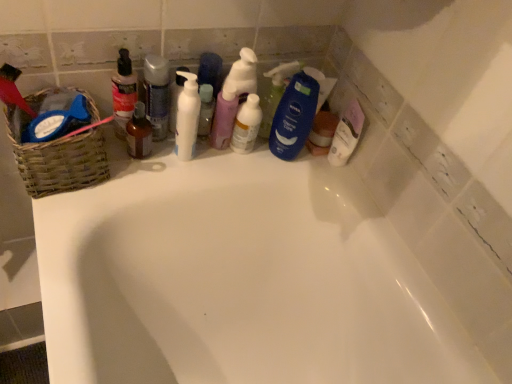
This screenshot has width=512, height=384. I want to click on translucent plastic spray bottle at center, the second cleaning product viewed from the right, so coord(246,125).

Measure the distance between point (300,141) and camera.

The distance of point (300,141) from camera is 37.95 inches.

What is the approximate width of woven brown basket at left?

The width of woven brown basket at left is 6.90 inches.

You are a GUI agent. You are given a task and a screenshot of the screen. Output one action in this format:
    pyautogui.click(x=<x>, y=<y>)
    Task: Click on the woven brown basket at left
    The image size is (512, 384).
    Given the screenshot: What is the action you would take?
    pyautogui.click(x=57, y=159)

The image size is (512, 384). I want to click on translucent plastic spray bottle at center, which appears as the 4th cleaning product when viewed from the right, so click(x=157, y=94).

Find the location of a particular element. The height and width of the screenshot is (384, 512). translucent plastic spray bottle at center, the second cleaning product viewed from the right is located at coordinates (246, 125).

Does woven brown basket at left have a greater width compared to translucent plastic spray bottle at center, which appears as the 4th cleaning product when viewed from the right?

Correct, the width of woven brown basket at left exceeds that of translucent plastic spray bottle at center, which appears as the 4th cleaning product when viewed from the right.

Which object is closer to the camera, woven brown basket at left or translucent plastic spray bottle at center, which appears as the 4th cleaning product when viewed from the right?

woven brown basket at left is more forward.

From the image's perspective, who appears lower, woven brown basket at left or translucent plastic spray bottle at center, the first cleaning product in the left-to-right sequence?

woven brown basket at left is shown below in the image.

How far apart are woven brown basket at left and translucent plastic spray bottle at center, which appears as the 4th cleaning product when viewed from the right?

7.02 inches.

Would you say translucent plastic bottle at upper left is to the left or to the right of brown glass bottle at center in the picture?

translucent plastic bottle at upper left is positioned on brown glass bottle at center's left side.

Considering the positions of points (126, 101) and (142, 132), is point (126, 101) closer to camera compared to point (142, 132)?

That is True.

Which of these two, translucent plastic bottle at upper left or brown glass bottle at center, stands taller?

With more height is translucent plastic bottle at upper left.

Find the location of a particular element. This screenshot has height=384, width=512. toiletry above the brown glass bottle at center (from the image's perspective) is located at coordinates click(123, 93).

From the image's perspective, is blue matte bottle at center, which is the first cleaning product from right to left, under white glossy bathtub at upper center?

Actually, blue matte bottle at center, which is the first cleaning product from right to left, appears above white glossy bathtub at upper center in the image.

Does point (294, 123) come in front of point (150, 255)?

No.

Between blue matte bottle at center, the 4th cleaning product when ordered from left to right, and white glossy bathtub at upper center, which one has more height?

white glossy bathtub at upper center.

How distant is blue matte bottle at center, which is the first cleaning product from right to left, from white glossy bathtub at upper center?

blue matte bottle at center, which is the first cleaning product from right to left, is 12.48 inches from white glossy bathtub at upper center.

Is translucent plastic spray bottle at center, the second cleaning product viewed from the right, positioned beyond the bounds of brown glass bottle at center?

Yes, translucent plastic spray bottle at center, the second cleaning product viewed from the right, is located beyond the bounds of brown glass bottle at center.

Where is `mouthwash in front of the translucent plastic spray bottle at center, the second cleaning product viewed from the right`? mouthwash in front of the translucent plastic spray bottle at center, the second cleaning product viewed from the right is located at coordinates (139, 133).

Considering the relative sizes of translucent plastic spray bottle at center, the second cleaning product viewed from the right, and brown glass bottle at center in the image provided, is translucent plastic spray bottle at center, the second cleaning product viewed from the right, wider than brown glass bottle at center?

Yes.

Based on the photo, does translucent plastic spray bottle at center, which is counted as the third cleaning product, starting from the left, appear on the left side of brown glass bottle at center?

In fact, translucent plastic spray bottle at center, which is counted as the third cleaning product, starting from the left, is to the right of brown glass bottle at center.

Choose the correct answer: Is brown glass bottle at center inside translucent plastic spray bottle at center, which is counted as the third cleaning product, starting from the left, or outside it?

brown glass bottle at center cannot be found inside translucent plastic spray bottle at center, which is counted as the third cleaning product, starting from the left.

Considering the relative sizes of brown glass bottle at center and translucent plastic spray bottle at center, which is counted as the third cleaning product, starting from the left, in the image provided, is brown glass bottle at center thinner than translucent plastic spray bottle at center, which is counted as the third cleaning product, starting from the left,?

Yes, brown glass bottle at center is thinner than translucent plastic spray bottle at center, which is counted as the third cleaning product, starting from the left.

Is point (144, 108) closer to camera compared to point (243, 141)?

Yes, point (144, 108) is in front of point (243, 141).

Considering the sizes of objects brown glass bottle at center and translucent plastic spray bottle at center, the second cleaning product viewed from the right, in the image provided, who is shorter, brown glass bottle at center or translucent plastic spray bottle at center, the second cleaning product viewed from the right,?

brown glass bottle at center.

Is white glossy bathtub at upper center oriented towards translucent plastic spray bottle at center, the first cleaning product in the left-to-right sequence?

No, white glossy bathtub at upper center is not oriented towards translucent plastic spray bottle at center, the first cleaning product in the left-to-right sequence.

From a real-world perspective, does white glossy bathtub at upper center stand above translucent plastic spray bottle at center, which appears as the 4th cleaning product when viewed from the right?

No, from a real-world perspective, white glossy bathtub at upper center is not above translucent plastic spray bottle at center, which appears as the 4th cleaning product when viewed from the right.

Is point (334, 257) less distant than point (165, 85)?

No, it is not.

Would you say translucent plastic spray bottle at center, the first cleaning product in the left-to-right sequence, is part of white glossy bathtub at upper center's contents?

No, translucent plastic spray bottle at center, the first cleaning product in the left-to-right sequence, is not surrounded by white glossy bathtub at upper center.

From the image's perspective, relative to blue matte bottle at center, the 4th cleaning product when ordered from left to right, is brown glass bottle at center above or below?

brown glass bottle at center is situated lower than blue matte bottle at center, the 4th cleaning product when ordered from left to right, in the image.

From the picture: Between brown glass bottle at center and blue matte bottle at center, the 4th cleaning product when ordered from left to right, which one has less height?

With less height is brown glass bottle at center.

Is blue matte bottle at center, the 4th cleaning product when ordered from left to right, inside brown glass bottle at center?

No, brown glass bottle at center does not contain blue matte bottle at center, the 4th cleaning product when ordered from left to right.

Looking at their sizes, would you say brown glass bottle at center is wider or thinner than blue matte bottle at center, the 4th cleaning product when ordered from left to right?

Considering their sizes, brown glass bottle at center looks broader than blue matte bottle at center, the 4th cleaning product when ordered from left to right.

The height and width of the screenshot is (384, 512). Identify the location of basket on the left of translucent plastic spray bottle at center, which appears as the 4th cleaning product when viewed from the right. (57, 159).

The width and height of the screenshot is (512, 384). In order to click on mouthwash below the translucent plastic bottle at upper left (from the image's perspective) in this screenshot , I will do `click(139, 133)`.

In the scene shown: Which object lies further to the anchor point translucent plastic spray bottle at center, the second cleaning product viewed from the right, translucent plastic bottle at upper left or translucent plastic spray bottle at center, which appears as the 4th cleaning product when viewed from the right?

translucent plastic bottle at upper left is positioned further to the anchor translucent plastic spray bottle at center, the second cleaning product viewed from the right.

Based on their spatial positions, is blue matte bottle at center, which is the first cleaning product from right to left, or translucent plastic spray bottle at center, the first cleaning product in the left-to-right sequence, further from woven brown basket at left?

blue matte bottle at center, which is the first cleaning product from right to left, is further to woven brown basket at left.

From the image, which object appears to be farther from translucent plastic bottle at upper left, translucent plastic spray bottle at center, which is counted as the third cleaning product, starting from the left, or pastel pink pump bottle at center, the 3th cleaning product when ordered from right to left?

translucent plastic spray bottle at center, which is counted as the third cleaning product, starting from the left, lies further to translucent plastic bottle at upper left than the other object.

Looking at the image, which one is located closer to blue matte bottle at center, which is the first cleaning product from right to left, white glossy bathtub at upper center or translucent plastic bottle at upper left?

Among the two, white glossy bathtub at upper center is located nearer to blue matte bottle at center, which is the first cleaning product from right to left.

Estimate the real-world distances between objects in this image. Which object is closer to woven brown basket at left, pastel pink pump bottle at center, the 3th cleaning product when ordered from right to left, or blue matte bottle at center, which is the first cleaning product from right to left?

The object closer to woven brown basket at left is pastel pink pump bottle at center, the 3th cleaning product when ordered from right to left.

Which object lies further to the anchor point brown glass bottle at center, translucent plastic bottle at upper left or translucent plastic spray bottle at center, the second cleaning product viewed from the right?

The object further to brown glass bottle at center is translucent plastic spray bottle at center, the second cleaning product viewed from the right.

When comparing their distances from translucent plastic spray bottle at center, the first cleaning product in the left-to-right sequence, does pastel pink pump bottle at center, the 3th cleaning product when ordered from right to left, or woven brown basket at left seem further?

Based on the image, woven brown basket at left appears to be further to translucent plastic spray bottle at center, the first cleaning product in the left-to-right sequence.

Which object lies nearer to the anchor point translucent plastic spray bottle at center, which appears as the 4th cleaning product when viewed from the right, translucent plastic bottle at upper left or brown glass bottle at center?

Based on the image, brown glass bottle at center appears to be nearer to translucent plastic spray bottle at center, which appears as the 4th cleaning product when viewed from the right.

Locate an element on the screen. The image size is (512, 384). toiletry between woven brown basket at left and brown glass bottle at center in the horizontal direction is located at coordinates (123, 93).

Locate an element on the screen. The image size is (512, 384). toiletry located between woven brown basket at left and blue matte bottle at center, the 4th cleaning product when ordered from left to right, in the left-right direction is located at coordinates (123, 93).

Locate an element on the screen. toiletry between woven brown basket at left and translucent plastic spray bottle at center, the second cleaning product viewed from the right, from left to right is located at coordinates (123, 93).

Identify the location of mouthwash located between translucent plastic bottle at upper left and translucent plastic spray bottle at center, which is counted as the third cleaning product, starting from the left, in the left-right direction. The image size is (512, 384). (139, 133).